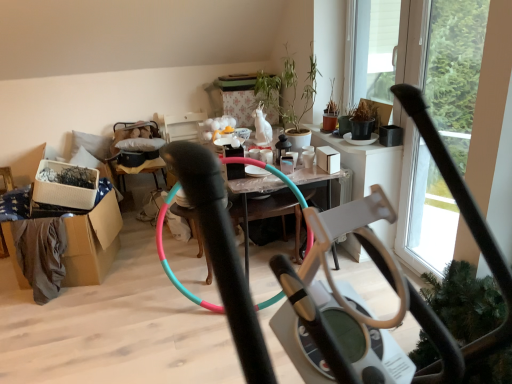
This screenshot has width=512, height=384. Find the location of `vacant space in front of brown cardboard box at left`. vacant space in front of brown cardboard box at left is located at coordinates (61, 321).